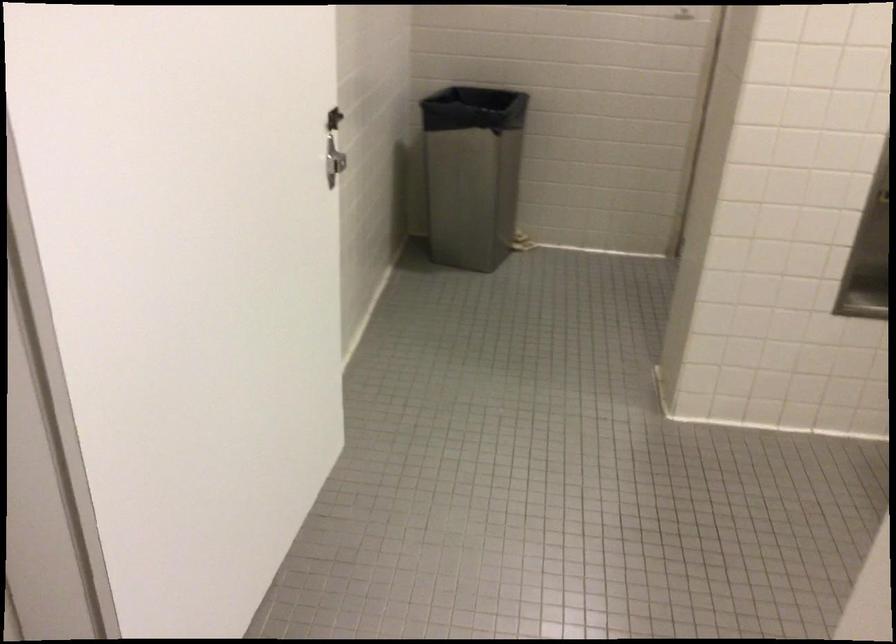
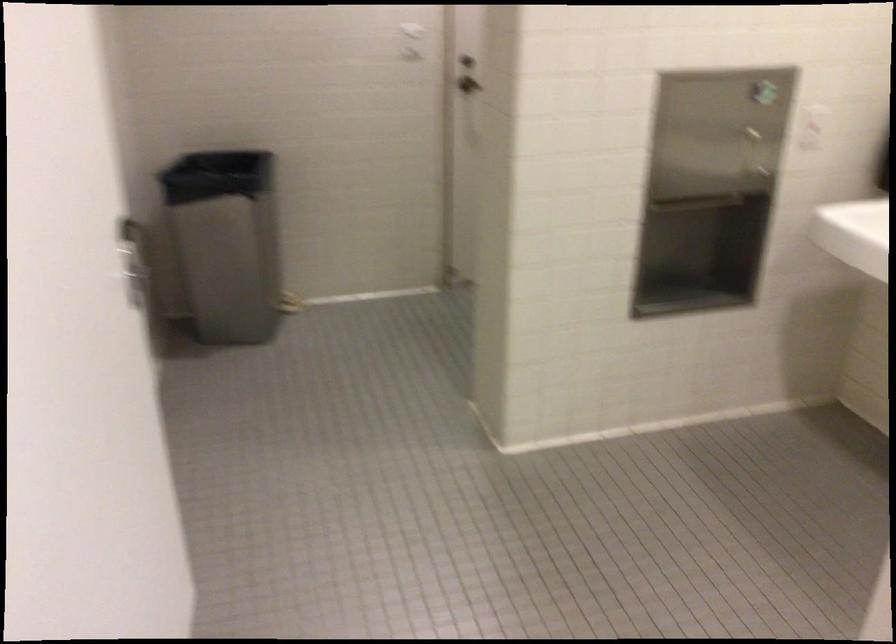
The images are taken continuously from a first-person perspective. In which direction are you moving?

The cameraman walked toward left, forward.